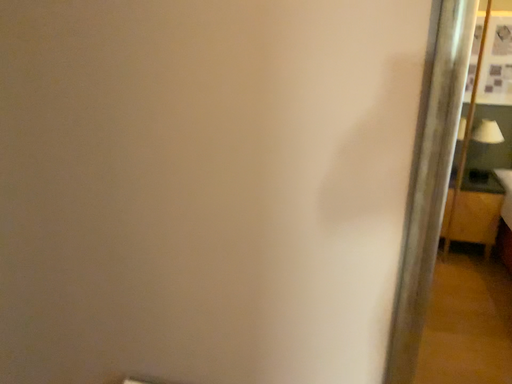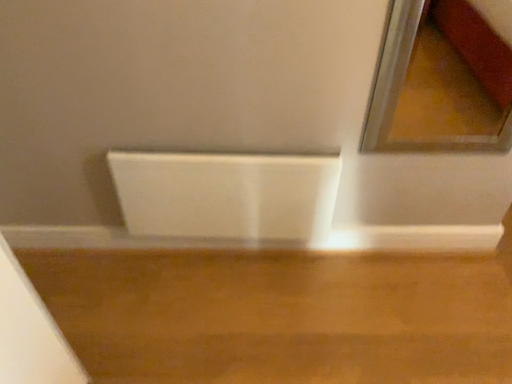
Question: How did the camera likely rotate when shooting the video?

Choices:
 (A) rotated left
 (B) rotated right

Answer: (B)